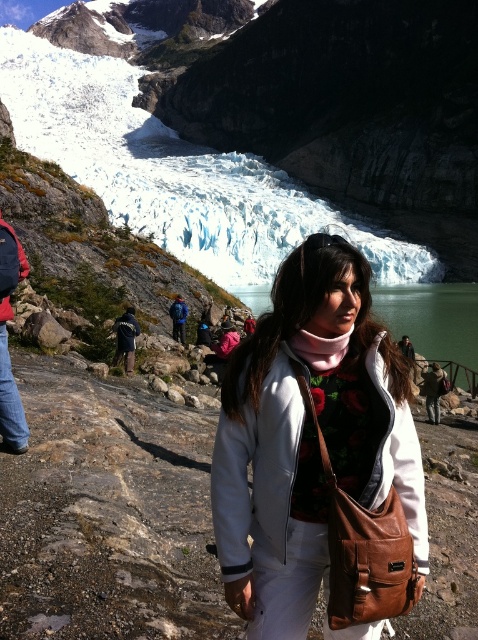
Based on the photo, does white leather jacket at center appear on the left side of brushed metal backpack at left?

No, white leather jacket at center is not to the left of brushed metal backpack at left.

Looking at this image, who is more forward, (x=270, y=445) or (x=15, y=435)?

Point (x=270, y=445)

Identify the location of white leather jacket at center. (318, 458).

Who is more forward, (x=304, y=602) or (x=462, y=339)?

Point (x=304, y=602)

The image size is (478, 640). Describe the element at coordinates (318, 458) in the screenshot. I see `white leather jacket at center` at that location.

Is point (241, 426) closer to viewer compared to point (447, 323)?

Yes, it is.

Where is `white leather jacket at center`? The width and height of the screenshot is (478, 640). white leather jacket at center is located at coordinates (318, 458).

Is green glassy lake at center thinner than brushed metal backpack at left?

No, green glassy lake at center is not thinner than brushed metal backpack at left.

Image resolution: width=478 pixels, height=640 pixels. Describe the element at coordinates (434, 323) in the screenshot. I see `green glassy lake at center` at that location.

Find the location of `green glassy lake at center`. green glassy lake at center is located at coordinates (434, 323).